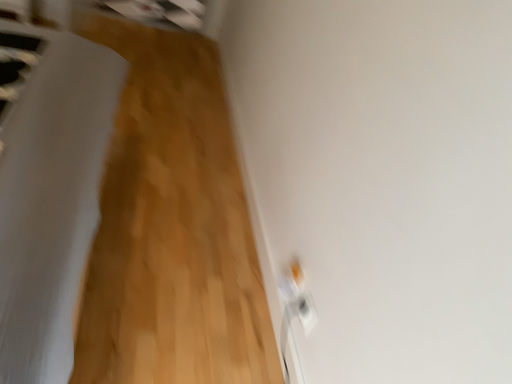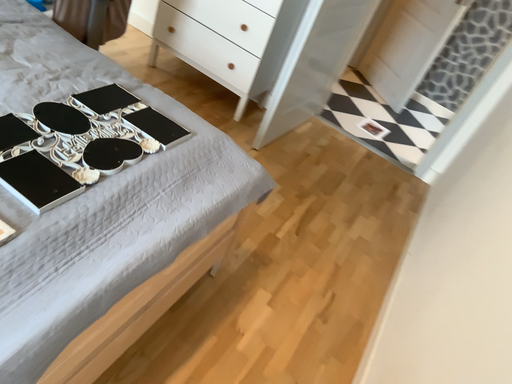
Question: Which way did the camera rotate in the video?

Choices:
 (A) rotated downward
 (B) rotated upward

Answer: (B)